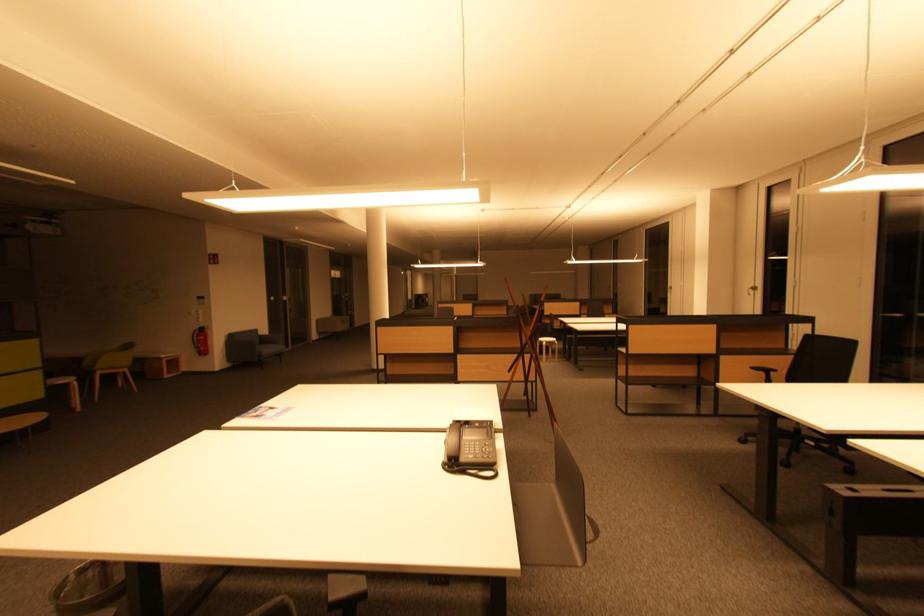
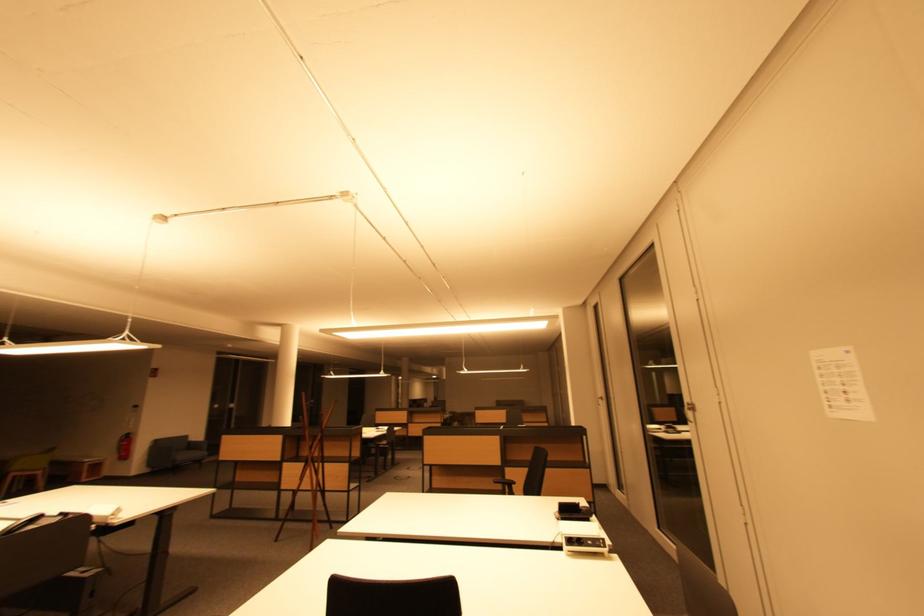
Question: What movement of the cameraman would produce the second image?

Choices:
 (A) Left
 (B) Right
 (C) Forward
 (D) Backward

Answer: (B)